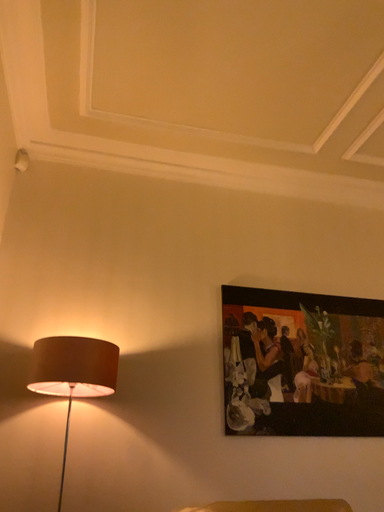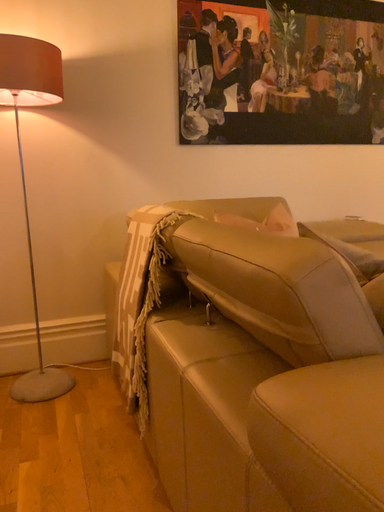
Question: Which way did the camera rotate in the video?

Choices:
 (A) rotated upward
 (B) rotated downward

Answer: (B)